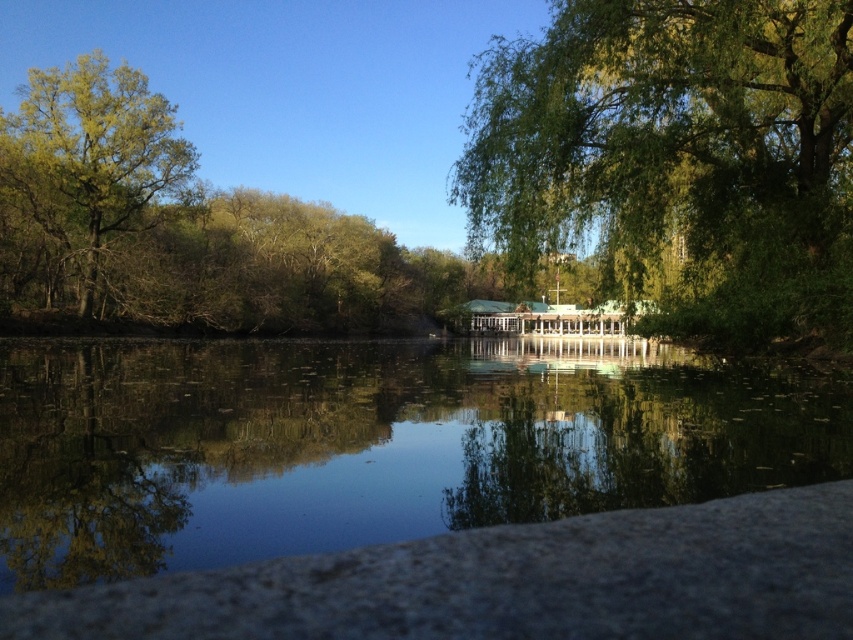
You are standing at the edge of the scene and want to locate the smooth reflective water at center. According to the coordinates provided, where would you find it?

The smooth reflective water at center is located at the 2D coordinates point of [369,444].

Based on the photo, you are standing at the stone ledge looking out at the water. There are two points marked on the water surface in front of you. The first point is at coordinates point (242, 465) and the second is at point (532, 220). Which point do you think is closer to your current position?

Point (242, 465) is closer to the viewer than point (532, 220), so the first point is closer to your current position.